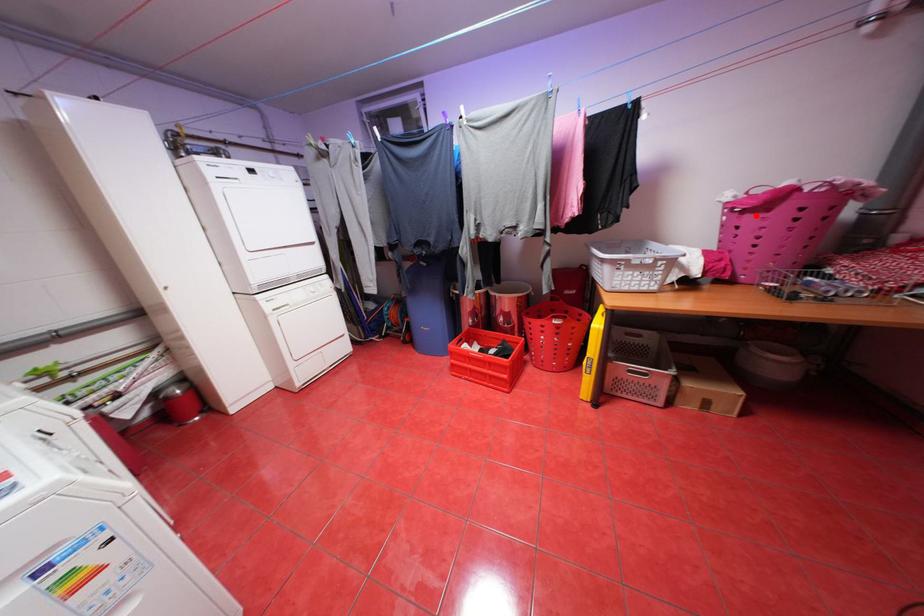
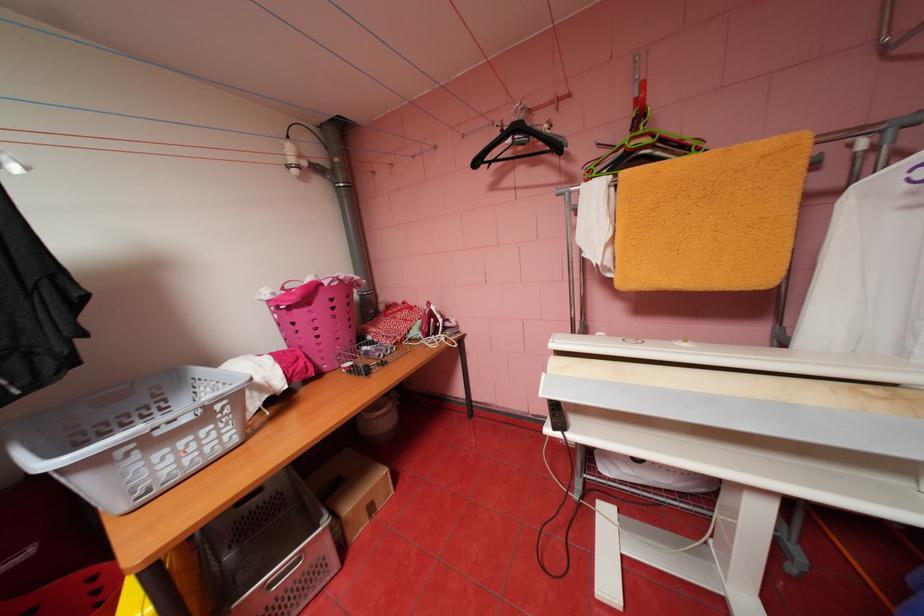
In the second image, find the point that corresponds to the highlighted location in the first image.

(304, 310)